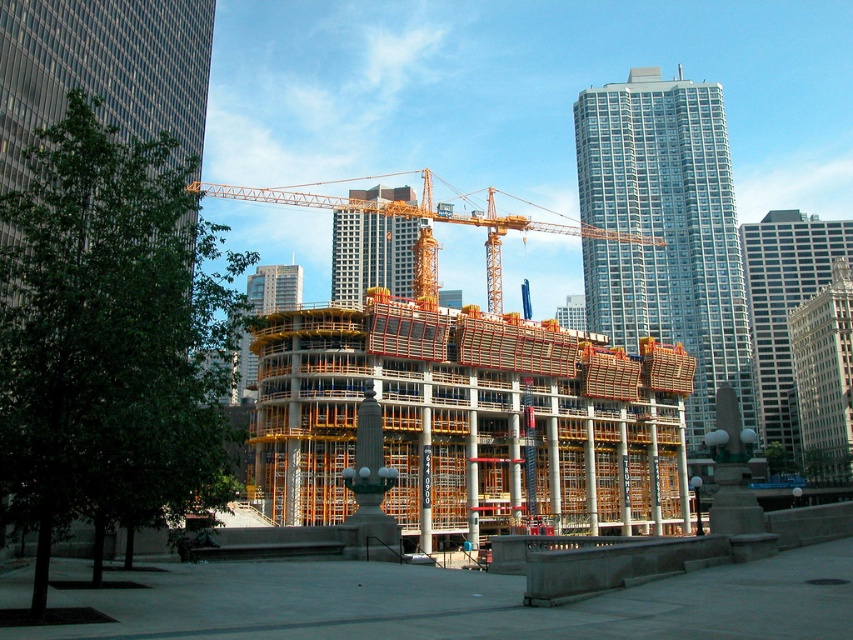
Does gray glass skyscraper at center come in front of yellow scaffolding at center?

No, it is behind yellow scaffolding at center.

Where is `gray glass skyscraper at center`? gray glass skyscraper at center is located at coordinates (824, 376).

Where is `gray glass skyscraper at center`? The width and height of the screenshot is (853, 640). gray glass skyscraper at center is located at coordinates (824, 376).

Is point (622, 115) closer to camera compared to point (343, 264)?

Yes, point (622, 115) is closer to viewer.

You are a GUI agent. You are given a task and a screenshot of the screen. Output one action in this format:
    pyautogui.click(x=<x>, y=<y>)
    Task: Click on the glassy steel skyscraper at upper right
    This screenshot has width=853, height=640.
    Given the screenshot: What is the action you would take?
    pyautogui.click(x=665, y=228)

Locate an element on the screen. The image size is (853, 640). glassy steel skyscraper at upper right is located at coordinates (665, 228).

Between metallic glass building at center and yellow scaffolding at center, which one has more height?

metallic glass building at center

Between metallic glass building at center and yellow scaffolding at center, which one appears on the left side from the viewer's perspective?

Positioned to the left is yellow scaffolding at center.

Who is more forward, (337, 216) or (293, 262)?

Point (337, 216)

Identify the location of metallic glass building at center. (370, 253).